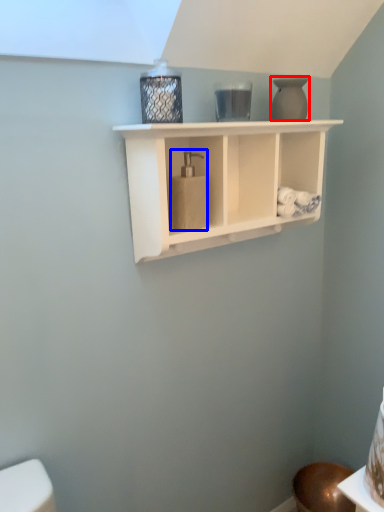
Question: Which object appears farthest to the camera in this image, vase (highlighted by a red box) or soap dispenser (highlighted by a blue box)?

Choices:
 (A) vase
 (B) soap dispenser

Answer: (A)